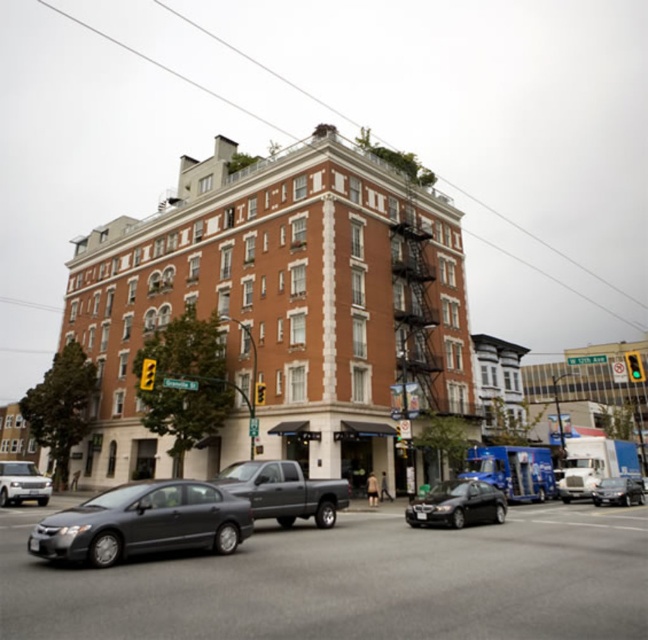
Question: Can you confirm if matte gray sedan at lower left is thinner than gray matte truck at center?

Choices:
 (A) no
 (B) yes

Answer: (A)

Question: Can you confirm if matte gray sedan at lower left is positioned above shiny silver sedan at center?

Choices:
 (A) no
 (B) yes

Answer: (B)

Question: Is the position of shiny black sedan at center more distant than that of silver metallic sedan at lower left?

Choices:
 (A) no
 (B) yes

Answer: (A)

Question: Which of these objects is positioned closest to the matte gray sedan at lower left?

Choices:
 (A) shiny black sedan at center
 (B) shiny silver sedan at center

Answer: (A)

Question: Which object is positioned closest to the shiny black sedan at center?

Choices:
 (A) silver metallic sedan at lower left
 (B) shiny silver sedan at center
 (C) matte gray sedan at lower left

Answer: (B)

Question: Based on their relative distances, which object is farther from the shiny silver sedan at center?

Choices:
 (A) metallic gray car at center
 (B) matte gray sedan at lower left
 (C) silver metallic sedan at lower left

Answer: (C)